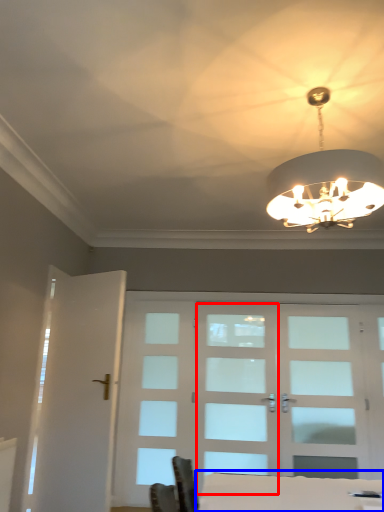
Question: Which point is closer to the camera, screen door (highlighted by a red box) or table (highlighted by a blue box)?

Choices:
 (A) screen door
 (B) table

Answer: (B)